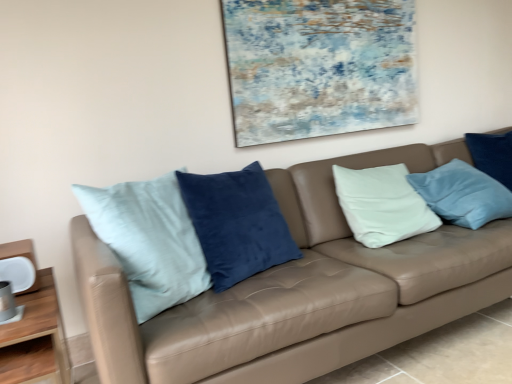
Question: Considering the positions of leather couch at center and textured canvas painting at upper center in the image, is leather couch at center taller or shorter than textured canvas painting at upper center?

Choices:
 (A) tall
 (B) short

Answer: (A)

Question: Choose the correct answer: Is leather couch at center inside textured canvas painting at upper center or outside it?

Choices:
 (A) inside
 (B) outside

Answer: (B)

Question: Based on their relative distances, which object is farther from the wooden table at lower left?

Choices:
 (A) textured canvas painting at upper center
 (B) leather couch at center
 (C) velvet blue pillow at right

Answer: (C)

Question: Estimate the real-world distances between objects in this image. Which object is farther from the velvet blue pillow at right?

Choices:
 (A) leather couch at center
 (B) textured canvas painting at upper center
 (C) wooden table at lower left

Answer: (C)